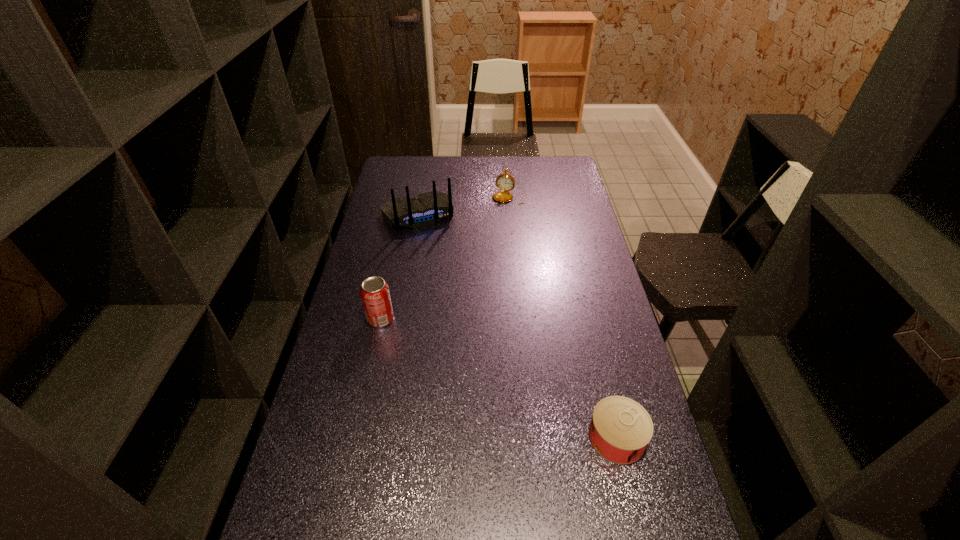
What are the coordinates of `free spot on the desktop that is between the soda can and the nearest object and is positioned on the back of the router` in the screenshot? It's located at point(494,376).

This screenshot has width=960, height=540. I want to click on free space on the desktop that is between the third shortest object and the shortest object and is positioned on the face of the pocket watch, so click(456, 357).